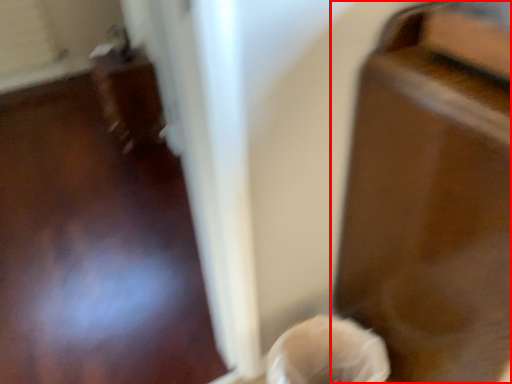
Question: Observing the image, what is the correct spatial positioning of furniture (annotated by the red box) in reference to woman?

Choices:
 (A) left
 (B) right

Answer: (B)